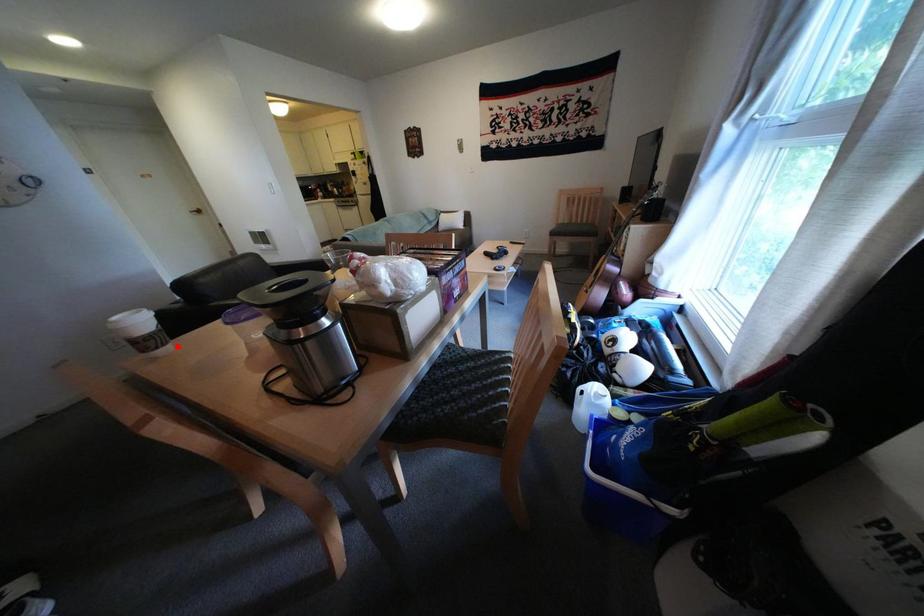
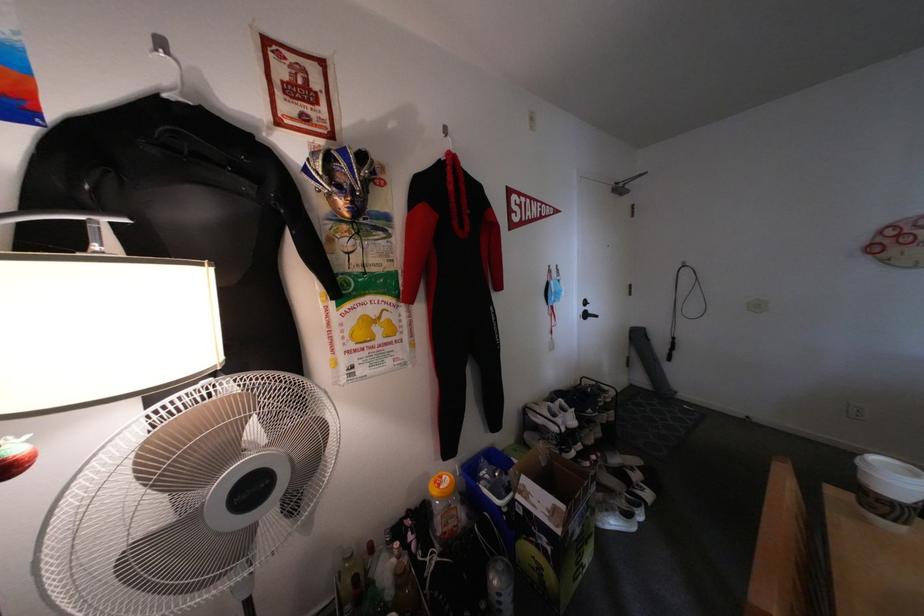
Where in the second image is the point corresponding to the highlighted location from the first image?

(909, 523)